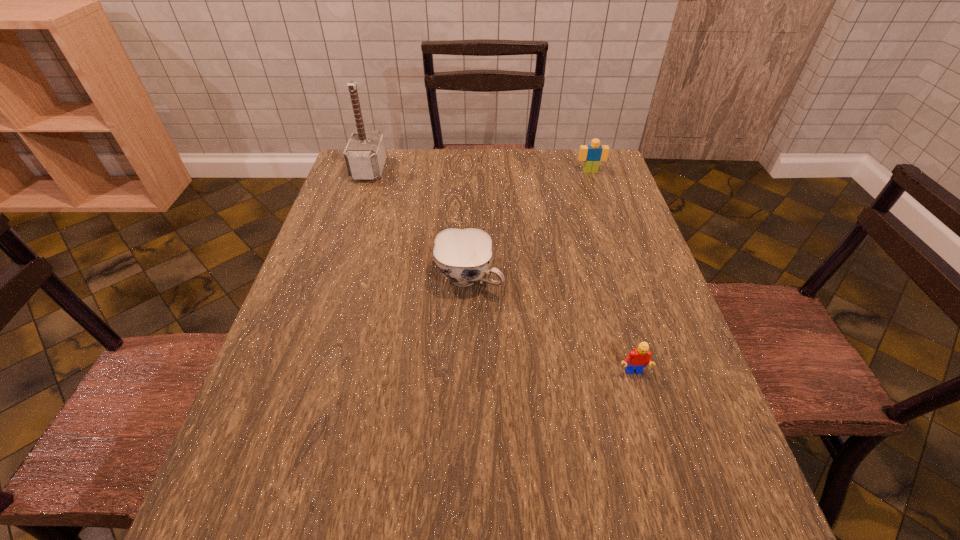
This screenshot has height=540, width=960. What are the coordinates of `free location that satisfies the following two spatial constraints: 1. for striking with the head of the tallest object; 2. on the right side of the second object from left to right` in the screenshot? It's located at (333, 278).